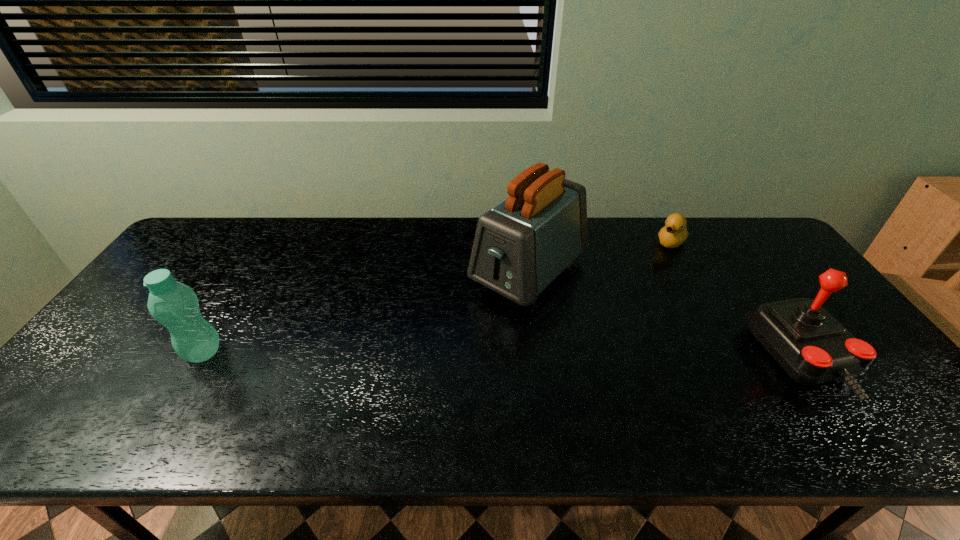
You are a GUI agent. You are given a task and a screenshot of the screen. Output one action in this format:
    pyautogui.click(x=<x>, y=<y>)
    Task: Click on the leftmost object
    The width and height of the screenshot is (960, 540).
    Given the screenshot: What is the action you would take?
    pyautogui.click(x=175, y=305)

Identify the location of the rightmost object. The height and width of the screenshot is (540, 960). (812, 347).

Locate an element on the screen. Image resolution: width=960 pixels, height=540 pixels. the third object from left to right is located at coordinates (674, 233).

This screenshot has height=540, width=960. What are the coordinates of `the shortest object` in the screenshot? It's located at (674, 233).

Find the location of a particular element. the third object from right to left is located at coordinates (521, 245).

You are a GUI agent. You are given a task and a screenshot of the screen. Output one action in this format:
    pyautogui.click(x=<x>, y=<y>)
    Task: Click on the tallest object
    This screenshot has height=540, width=960.
    Given the screenshot: What is the action you would take?
    [521, 245]

The width and height of the screenshot is (960, 540). I want to click on free space located 0.370m on the back of the bottle, so click(264, 251).

At what (x,y) coordinates should I click in order to perform the action: click on vacant region located 0.380m on the left of the joystick. Please return your answer as a coordinate pair (x, y). Image resolution: width=960 pixels, height=540 pixels. Looking at the image, I should click on (606, 359).

At what (x,y) coordinates should I click in order to perform the action: click on vacant area situated 0.130m facing forward on the duckling. Please return your answer as a coordinate pair (x, y). Image resolution: width=960 pixels, height=540 pixels. Looking at the image, I should click on (650, 269).

At what (x,y) coordinates should I click in order to perform the action: click on free spot located facing forward on the duckling. Please return your answer as a coordinate pair (x, y). Looking at the image, I should click on (660, 257).